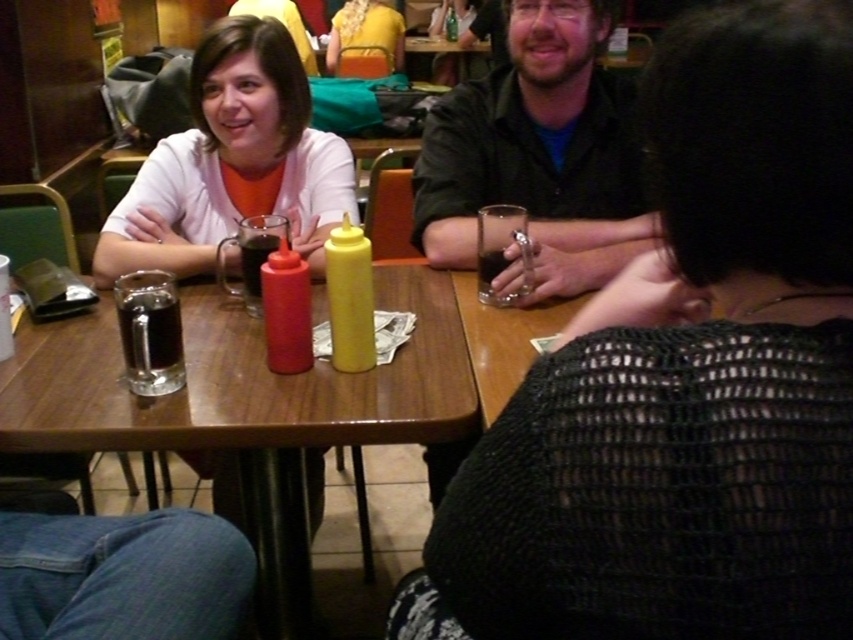
Does black glass mug at center have a greater height compared to dark matte glass at center?

Correct, black glass mug at center is much taller as dark matte glass at center.

Can you confirm if black glass mug at center is smaller than dark matte glass at center?

Yes, black glass mug at center is smaller than dark matte glass at center.

Is point (157, 308) in front of point (508, 282)?

Yes, it is in front of point (508, 282).

Where is `black glass mug at center`? black glass mug at center is located at coordinates (149, 332).

Is wooden table at center taller than dark matte glass at center?

Yes, wooden table at center is taller than dark matte glass at center.

Which is above, wooden table at center or dark matte glass at center?

dark matte glass at center is higher up.

Locate an element on the screen. This screenshot has height=640, width=853. wooden table at center is located at coordinates (247, 406).

Does knitted black sweater at center appear on the left side of yellow fabric shirt at center?

No, knitted black sweater at center is not to the left of yellow fabric shirt at center.

How far apart are knitted black sweater at center and yellow fabric shirt at center?

knitted black sweater at center and yellow fabric shirt at center are 15.54 feet apart from each other.

Which is behind, point (508, 426) or point (347, 20)?

Point (347, 20)

I want to click on knitted black sweater at center, so click(686, 380).